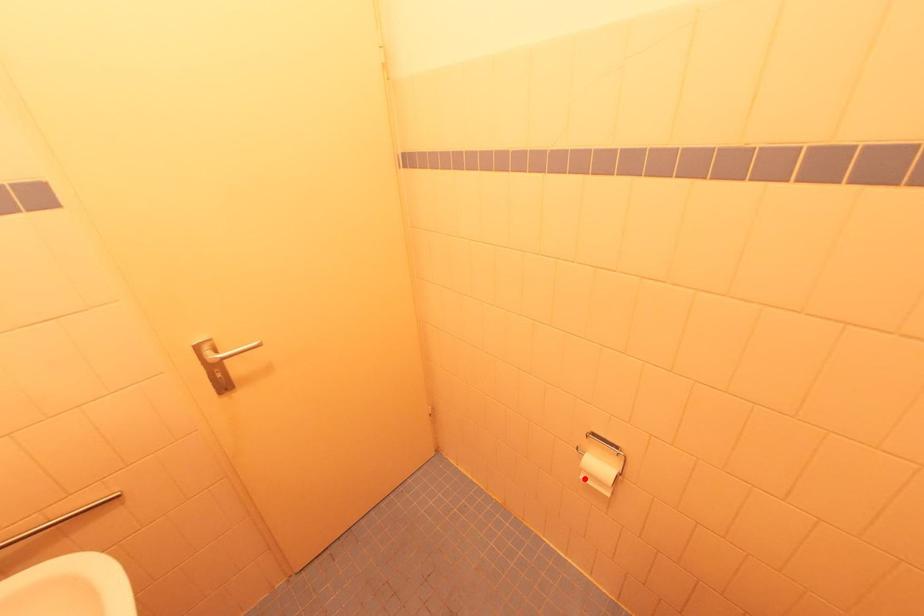
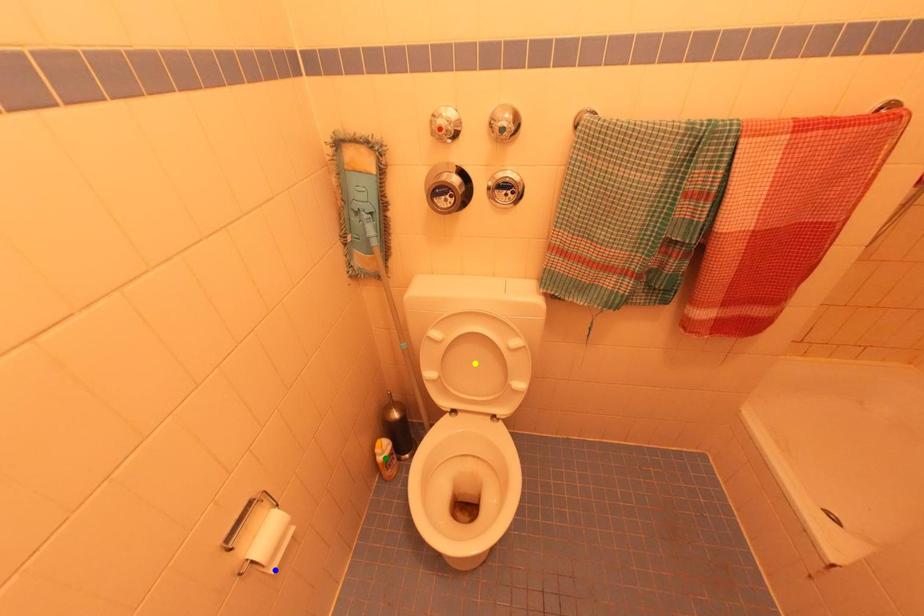
Question: I am providing you with two images of the same scene from different viewpoints. A red point is marked on the first image. You are given multiple points on the second image. Which point in image 2 is actually the same real-world point as the red point in image 1?

Choices:
 (A) blue point
 (B) green point
 (C) yellow point

Answer: (A)